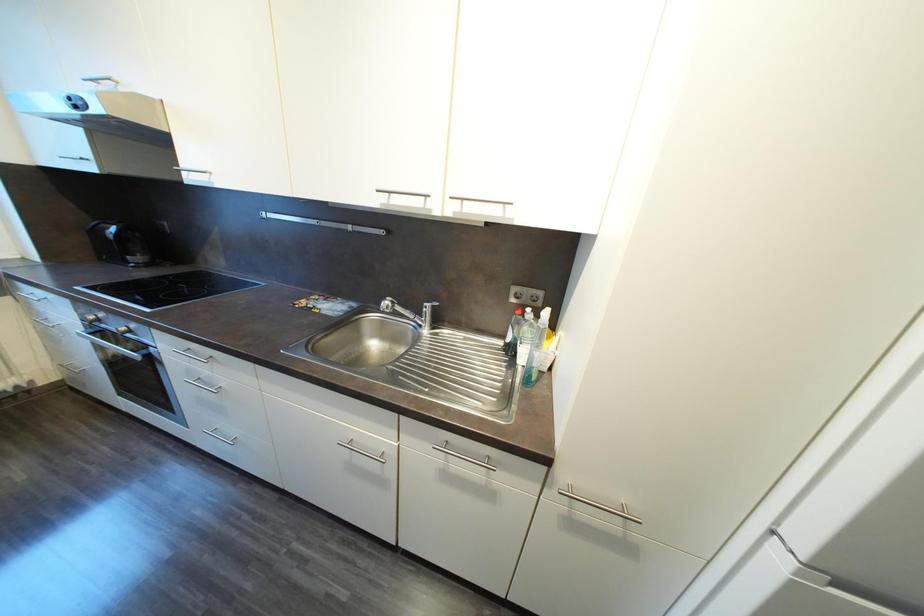
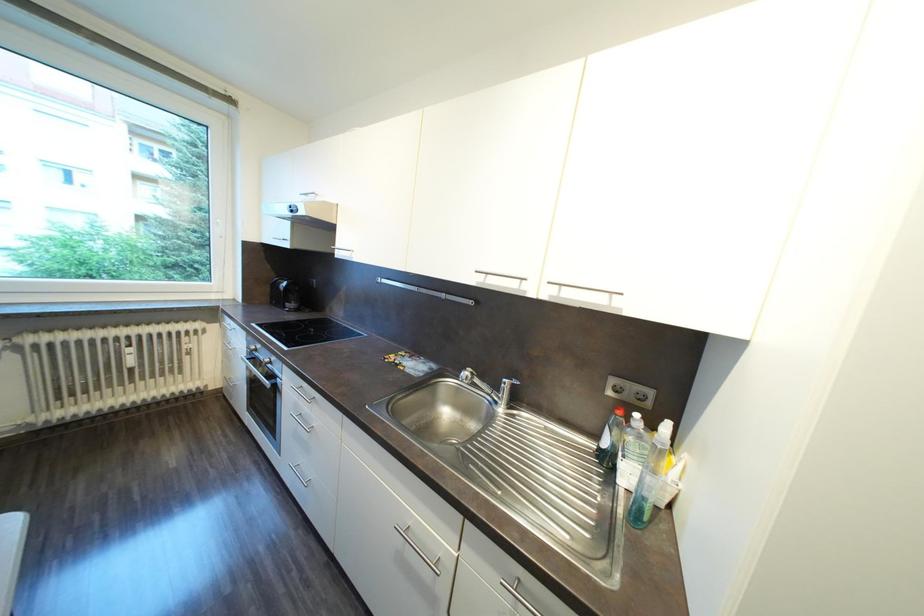
Question: The first image is from the beginning of the video and the second image is from the end. How did the camera likely rotate when shooting the video?

Choices:
 (A) Left
 (B) Right
 (C) Up
 (D) Down

Answer: (A)